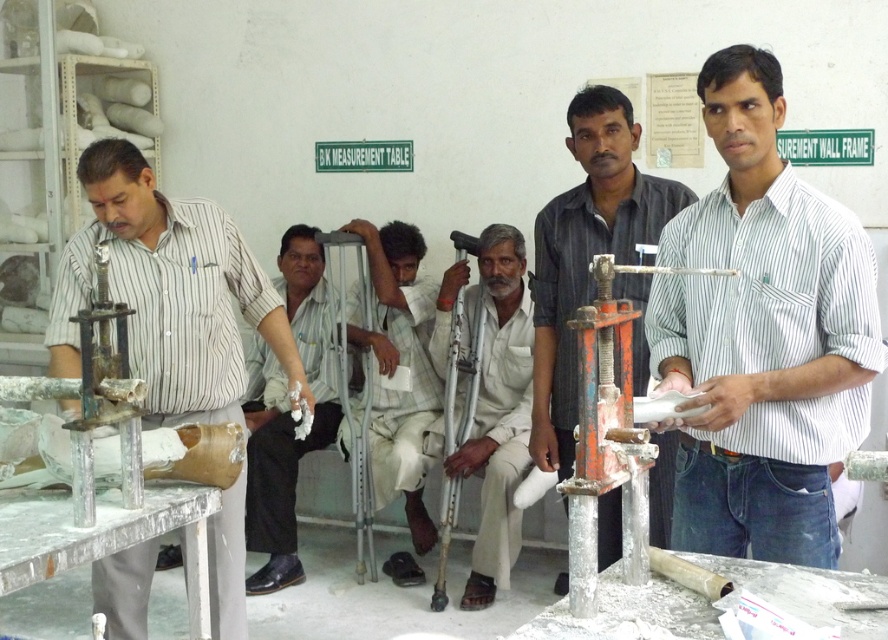
Question: Based on their relative distances, which object is nearer to the white striped shirt at center?

Choices:
 (A) white fabric crutches at center
 (B) orange metallic machine at center
 (C) white checkered shirt at center
 (D) matte striped shirt at left

Answer: (B)

Question: Which is farther from the white checkered shirt at center?

Choices:
 (A) white fabric crutches at center
 (B) white matte crutches at center

Answer: (A)

Question: Which of the following is the closest to the observer?

Choices:
 (A) (378, 465)
 (B) (328, 403)
 (C) (489, 465)
 (D) (834, 337)

Answer: (D)

Question: Can you confirm if orange metallic machine at center is positioned to the right of white checkered shirt at center?

Choices:
 (A) no
 (B) yes

Answer: (B)

Question: Can you confirm if orange metallic machine at center is wider than white checkered shirt at center?

Choices:
 (A) yes
 (B) no

Answer: (A)

Question: Does orange metallic machine at center appear on the right side of white checkered shirt at center?

Choices:
 (A) no
 (B) yes

Answer: (B)